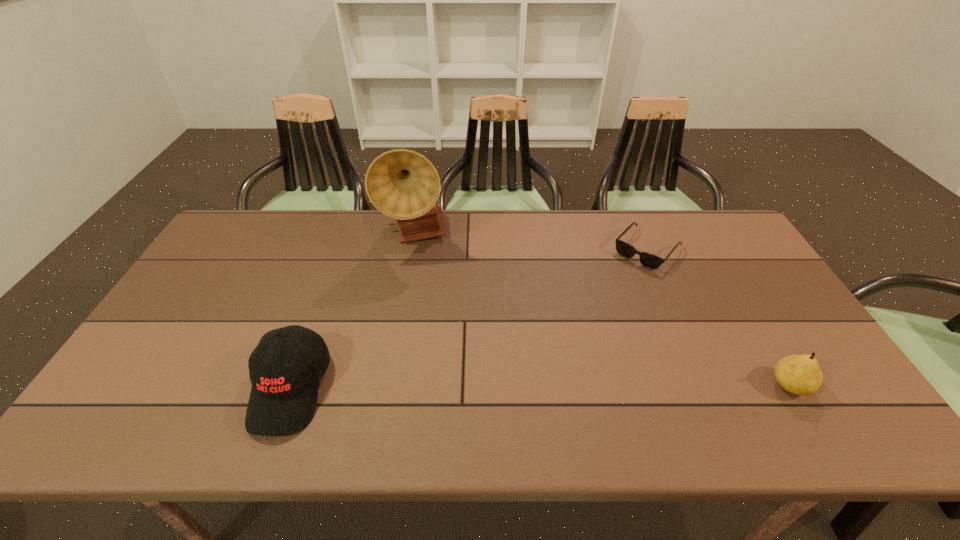
Where is `free space between the rightmost object and the shortest object`? This screenshot has height=540, width=960. free space between the rightmost object and the shortest object is located at coordinates (718, 318).

The image size is (960, 540). Identify the location of free space between the shortest object and the rightmost object. (718, 318).

Identify the location of empty space that is in between the rightmost object and the second object from left to right. (603, 310).

Identify the location of empty space that is in between the second object from right to left and the tallest object. Image resolution: width=960 pixels, height=540 pixels. (532, 242).

Locate which object is the closest to the rightmost object. Please provide its 2D coordinates. Your answer should be formatted as a tuple, i.e. [(x, y)], where the tuple contains the x and y coordinates of a point satisfying the conditions above.

[(648, 260)]

Locate which object is the third closest to the shortest object. Please provide its 2D coordinates. Your answer should be formatted as a tuple, i.e. [(x, y)], where the tuple contains the x and y coordinates of a point satisfying the conditions above.

[(283, 397)]